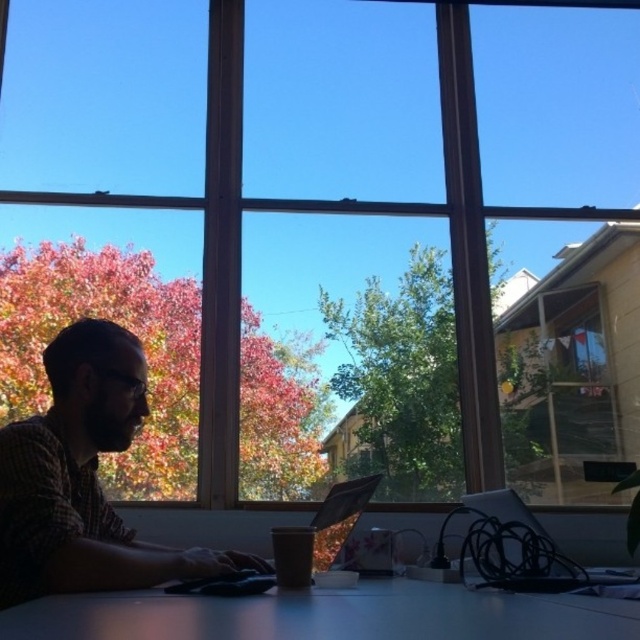
Question: Is white glossy table at center smaller than metallic silver laptop at center?

Choices:
 (A) yes
 (B) no

Answer: (B)

Question: Where is matte plaid shirt at left located in relation to white glossy table at center in the image?

Choices:
 (A) left
 (B) right

Answer: (A)

Question: Which of the following is the farthest from the observer?

Choices:
 (A) (92, 374)
 (B) (376, 616)

Answer: (A)

Question: Which point appears farthest from the camera in this image?

Choices:
 (A) (70, 589)
 (B) (308, 532)

Answer: (B)

Question: Is matte plaid shirt at left in front of metallic silver laptop at center?

Choices:
 (A) no
 (B) yes

Answer: (B)

Question: Which is farther from the matte plaid shirt at left?

Choices:
 (A) white glossy table at center
 (B) metallic silver laptop at center

Answer: (A)